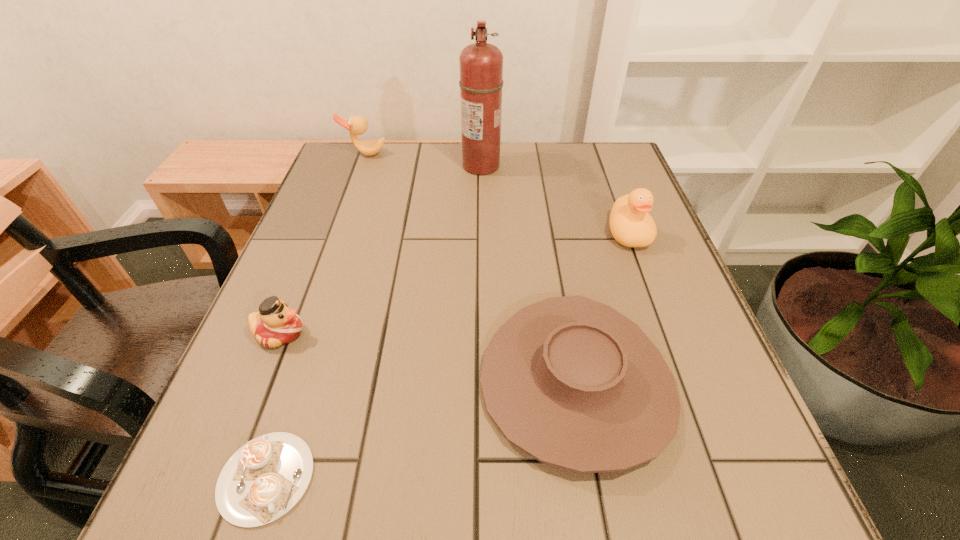
Identify which duck is the second nearest to the shortest duck. Please provide its 2D coordinates. Your answer should be formatted as a tuple, i.e. [(x, y)], where the tuple contains the x and y coordinates of a point satisfying the conditions above.

[(631, 225)]

Find the location of a particular element. This screenshot has width=960, height=540. duck that is the closest to the shortest object is located at coordinates (276, 324).

Find the location of a particular element. This screenshot has height=540, width=960. vacant space that satisfies the following two spatial constraints: 1. on the face of the cappuccino; 2. on the right side of the nearest duck is located at coordinates (222, 477).

The width and height of the screenshot is (960, 540). In order to click on vacant region that satisfies the following two spatial constraints: 1. on the beak of the farthest duck; 2. on the face of the shortest duck in this screenshot , I will do `click(300, 333)`.

Locate an element on the screen. The width and height of the screenshot is (960, 540). vacant space that satisfies the following two spatial constraints: 1. on the face of the shortest duck; 2. on the right side of the cowboy hat is located at coordinates (260, 383).

Locate an element on the screen. free space that satisfies the following two spatial constraints: 1. on the beak of the farthest duck; 2. on the face of the nearest duck is located at coordinates (300, 333).

Locate an element on the screen. The height and width of the screenshot is (540, 960). vacant area in the image that satisfies the following two spatial constraints: 1. on the beak of the farthest duck; 2. on the face of the shortest duck is located at coordinates (300, 333).

I want to click on free location that satisfies the following two spatial constraints: 1. on the beak of the farthest duck; 2. on the face of the nearest duck, so click(300, 333).